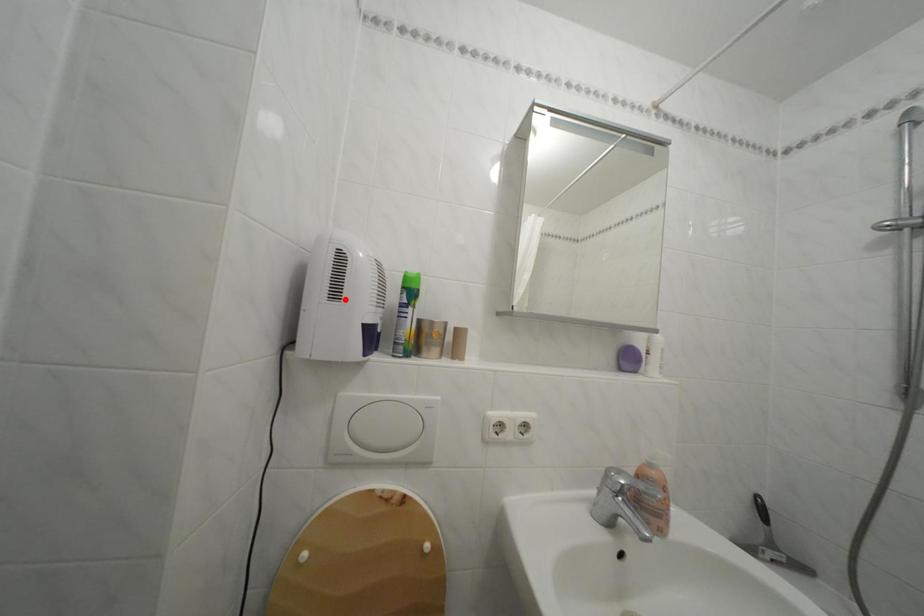
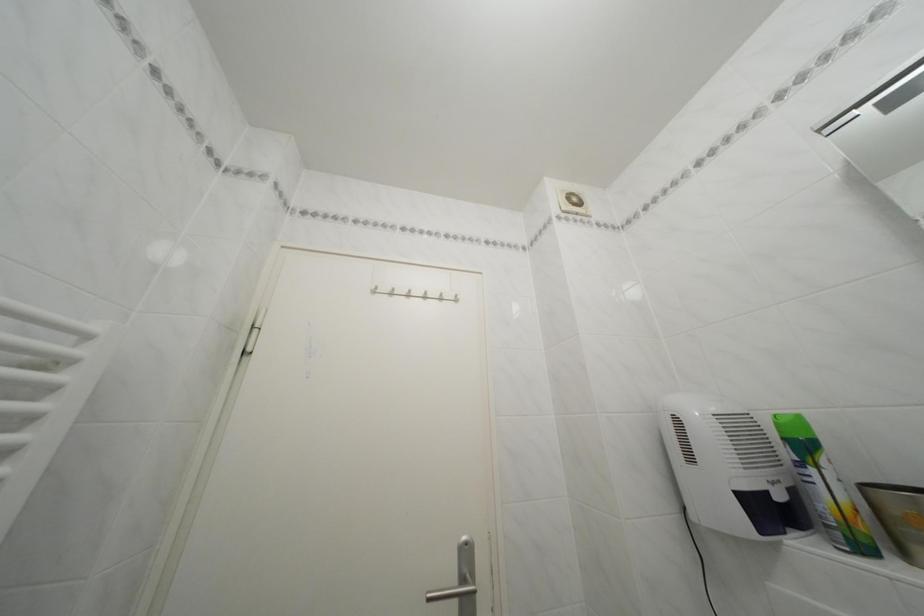
Find the pixel in the second image that matches the highlighted location in the first image.

(699, 464)